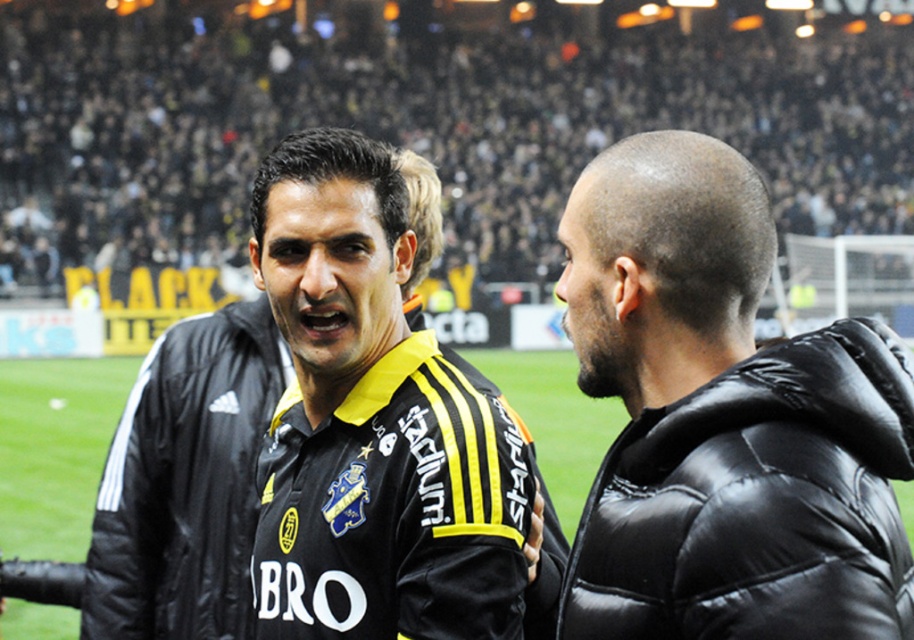
You are standing in the soccer stadium and want to take a photo of the black puffy jacket at right. Where should you position yourself to capture it in your camera frame?

To capture the black puffy jacket at right in your camera frame, position yourself so that the jacket is centered at the coordinates corresponding to the point 0.658 on the x and y axes within the image plane.